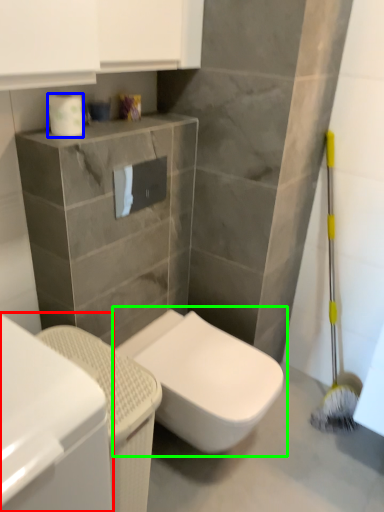
Question: Which object is positioned closest to cabinetry (highlighted by a red box)? Select from toilet paper (highlighted by a blue box) and toilet (highlighted by a green box).

Choices:
 (A) toilet paper
 (B) toilet

Answer: (B)